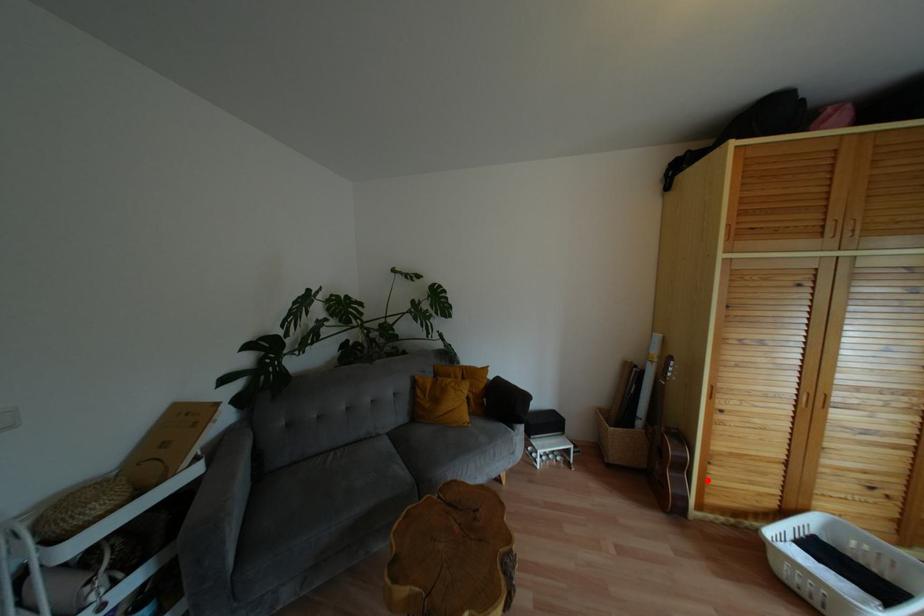
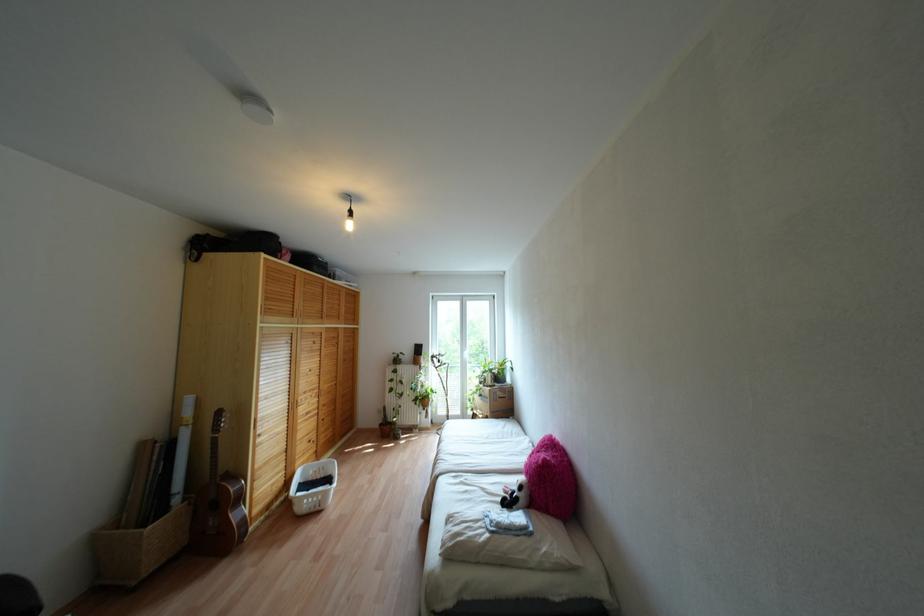
In the second image, find the point that corresponds to the highlighted location in the first image.

(253, 495)